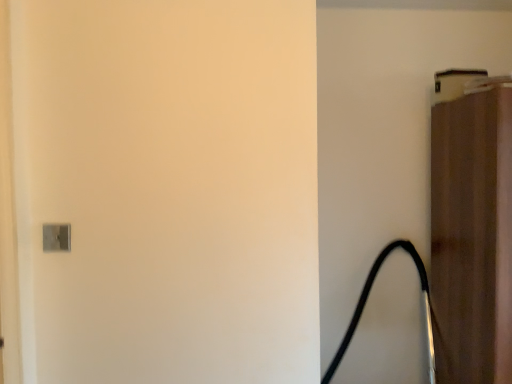
Describe the element at coordinates (472, 234) in the screenshot. This screenshot has width=512, height=384. I see `brown fabric door at upper right` at that location.

The image size is (512, 384). I want to click on brown fabric door at upper right, so click(472, 234).

The width and height of the screenshot is (512, 384). Describe the element at coordinates (367, 299) in the screenshot. I see `black rubber hose at right` at that location.

Find the location of a particular element. The image size is (512, 384). black rubber hose at right is located at coordinates point(367,299).

I want to click on brown fabric door at upper right, so click(472, 234).

From the picture: Which object is positioned more to the left, black rubber hose at right or brown fabric door at upper right?

Positioned to the left is black rubber hose at right.

Is black rubber hose at right in front of brown fabric door at upper right?

No, the depth of black rubber hose at right is greater than that of brown fabric door at upper right.

Considering the points (324, 377) and (506, 244), which point is in front, point (324, 377) or point (506, 244)?

Point (506, 244)

From the image's perspective, is black rubber hose at right on brown fabric door at upper right?

No, from the image's perspective, black rubber hose at right is not on top of brown fabric door at upper right.

From a real-world perspective, is black rubber hose at right physically located above or below brown fabric door at upper right?

black rubber hose at right is below brown fabric door at upper right.

Which of these two, black rubber hose at right or brown fabric door at upper right, is thinner?

Thinner between the two is brown fabric door at upper right.

Which of these two, black rubber hose at right or brown fabric door at upper right, stands taller?

Standing taller between the two is brown fabric door at upper right.

Is black rubber hose at right smaller than brown fabric door at upper right?

Correct, black rubber hose at right occupies less space than brown fabric door at upper right.

Consider the image. Is brown fabric door at upper right a part of black rubber hose at right?

Definitely not — brown fabric door at upper right is not inside black rubber hose at right.

Is black rubber hose at right with brown fabric door at upper right?

No.

Is brown fabric door at upper right at the back of black rubber hose at right?

No, black rubber hose at right is not facing away from brown fabric door at upper right.

What's the angular difference between black rubber hose at right and brown fabric door at upper right's facing directions?

The facing directions of black rubber hose at right and brown fabric door at upper right are 5.24e-05 degrees apart.

You are a GUI agent. You are given a task and a screenshot of the screen. Output one action in this format:
    pyautogui.click(x=<x>, y=<y>)
    Task: Click on the door in front of the black rubber hose at right
    This screenshot has width=512, height=384.
    Given the screenshot: What is the action you would take?
    pyautogui.click(x=472, y=234)

Is brown fabric door at upper right at the left side of black rubber hose at right?

No, brown fabric door at upper right is not to the left of black rubber hose at right.

Which is in front, brown fabric door at upper right or black rubber hose at right?

brown fabric door at upper right is in front.

Is point (472, 186) closer to camera compared to point (410, 254)?

Yes, point (472, 186) is closer to viewer.

From the image's perspective, between brown fabric door at upper right and black rubber hose at right, who is located below?

From the image's view, black rubber hose at right is below.

From a real-world perspective, relative to black rubber hose at right, is brown fabric door at upper right vertically above or below?

From a real-world perspective, brown fabric door at upper right is physically above black rubber hose at right.

Looking at their sizes, would you say brown fabric door at upper right is wider or thinner than black rubber hose at right?

Clearly, brown fabric door at upper right has less width compared to black rubber hose at right.

Which of these two, brown fabric door at upper right or black rubber hose at right, stands taller?

With more height is brown fabric door at upper right.

Is brown fabric door at upper right smaller than black rubber hose at right?

Incorrect, brown fabric door at upper right is not smaller in size than black rubber hose at right.

Is black rubber hose at right a part of brown fabric door at upper right?

No, black rubber hose at right is not a part of brown fabric door at upper right.

Is brown fabric door at upper right with black rubber hose at right?

They are not placed beside each other.

Is black rubber hose at right at the back of brown fabric door at upper right?

No, brown fabric door at upper right's orientation is not away from black rubber hose at right.

Consider the image. What's the angular difference between brown fabric door at upper right and black rubber hose at right's facing directions?

5.24e-05 degrees separate the facing orientations of brown fabric door at upper right and black rubber hose at right.

Measure the distance from brown fabric door at upper right to black rubber hose at right.

They are 16.98 inches apart.

At what (x,y) coordinates should I click in order to perform the action: click on door above the black rubber hose at right (from the image's perspective). Please return your answer as a coordinate pair (x, y). The height and width of the screenshot is (384, 512). Looking at the image, I should click on (472, 234).

I want to click on door on the right of black rubber hose at right, so click(472, 234).

The width and height of the screenshot is (512, 384). I want to click on door above the black rubber hose at right (from the image's perspective), so click(x=472, y=234).